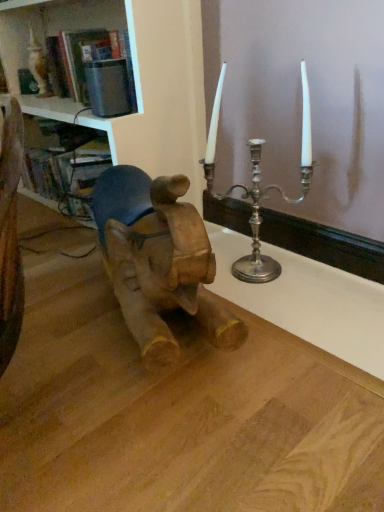
What is the approximate width of white glossy bookshelf at upper left?

white glossy bookshelf at upper left is 14.90 inches in width.

Locate an element on the screen. white glossy bookshelf at upper left is located at coordinates (136, 96).

From a real-world perspective, is wooden table at center beneath white glossy bookshelf at upper left?

Correct, in the physical world, wooden table at center is lower than white glossy bookshelf at upper left.

Image resolution: width=384 pixels, height=512 pixels. I want to click on shelf above the wooden table at center (from a real-world perspective), so click(136, 96).

Would you say wooden table at center is outside white glossy bookshelf at upper left?

That's correct, wooden table at center is outside of white glossy bookshelf at upper left.

Is wooden table at center positioned in front of white glossy bookshelf at upper left?

Yes.

From the image's perspective, which is above, wooden table at center or wooden baby elephant at left?

wooden baby elephant at left, from the image's perspective.

Is wooden table at center surrounding wooden baby elephant at left?

No, wooden table at center does not contain wooden baby elephant at left.

Is wooden table at center oriented towards wooden baby elephant at left?

Yes.

Is wooden table at center closer to the viewer compared to wooden baby elephant at left?

That is True.

Considering the sizes of white glossy bookshelf at upper left and wooden baby elephant at left in the image, is white glossy bookshelf at upper left taller or shorter than wooden baby elephant at left?

In the image, white glossy bookshelf at upper left appears to be taller than wooden baby elephant at left.

From the picture: Is white glossy bookshelf at upper left closer to the viewer compared to wooden baby elephant at left?

No, it is not.

From a real-world perspective, relative to wooden baby elephant at left, is white glossy bookshelf at upper left vertically above or below?

From a real-world perspective, white glossy bookshelf at upper left is physically above wooden baby elephant at left.

Can you tell me how much white glossy bookshelf at upper left and wooden baby elephant at left differ in facing direction?

There is a 20.1-degree angle between the facing directions of white glossy bookshelf at upper left and wooden baby elephant at left.

Is wooden baby elephant at left facing away from wooden table at center?

No, wooden table at center is not at the back of wooden baby elephant at left.

Find the location of a particular element. The height and width of the screenshot is (512, 384). baby elephant above the wooden table at center (from the image's perspective) is located at coordinates (158, 260).

Considering the relative positions of wooden baby elephant at left and wooden table at center in the image provided, is wooden baby elephant at left to the left of wooden table at center from the viewer's perspective?

No.

From a real-world perspective, is wooden baby elephant at left located beneath white glossy bookshelf at upper left?

Yes, from a real-world perspective, wooden baby elephant at left is beneath white glossy bookshelf at upper left.

Which is correct: wooden baby elephant at left is inside white glossy bookshelf at upper left, or outside of it?

The correct answer is: outside.

Based on the photo, how much distance is there between wooden baby elephant at left and white glossy bookshelf at upper left?

wooden baby elephant at left and white glossy bookshelf at upper left are 17.94 inches apart from each other.

From the picture: Does wooden baby elephant at left have a larger size compared to white glossy bookshelf at upper left?

Actually, wooden baby elephant at left might be smaller than white glossy bookshelf at upper left.

Looking at their sizes, would you say white glossy bookshelf at upper left is wider or thinner than wooden table at center?

Clearly, white glossy bookshelf at upper left has less width compared to wooden table at center.

Considering the relative positions of white glossy bookshelf at upper left and wooden table at center in the image provided, is white glossy bookshelf at upper left to the left of wooden table at center from the viewer's perspective?

Yes.

Is point (130, 26) positioned before point (180, 368)?

No, it is behind (180, 368).

Is white glossy bookshelf at upper left not within wooden table at center?

Yes, white glossy bookshelf at upper left is not within wooden table at center.

Identify the location of shelf positioned vertically above the wooden table at center (from a real-world perspective). Image resolution: width=384 pixels, height=512 pixels. (136, 96).

Where is `table below the wooden baby elephant at left (from the image's perspective)`? table below the wooden baby elephant at left (from the image's perspective) is located at coordinates (177, 413).

Considering their positions, is wooden table at center positioned closer to white glossy bookshelf at upper left than wooden baby elephant at left?

wooden baby elephant at left is closer to white glossy bookshelf at upper left.

Looking at the image, which one is located further to wooden baby elephant at left, wooden table at center or white glossy bookshelf at upper left?

white glossy bookshelf at upper left.

Looking at the image, which one is located closer to white glossy bookshelf at upper left, wooden baby elephant at left or wooden table at center?

The object closer to white glossy bookshelf at upper left is wooden baby elephant at left.

Looking at the image, which one is located closer to wooden table at center, wooden baby elephant at left or white glossy bookshelf at upper left?

Based on the image, wooden baby elephant at left appears to be nearer to wooden table at center.

Considering their positions, is white glossy bookshelf at upper left positioned closer to wooden baby elephant at left than wooden table at center?

wooden table at center.

Considering their positions, is white glossy bookshelf at upper left positioned further to wooden table at center than wooden baby elephant at left?

Among the two, white glossy bookshelf at upper left is located further to wooden table at center.

Identify the location of baby elephant that lies between white glossy bookshelf at upper left and wooden table at center from top to bottom. Image resolution: width=384 pixels, height=512 pixels. (158, 260).